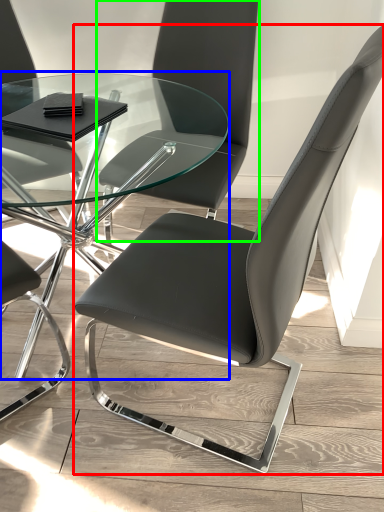
Question: Estimate the real-world distances between objects in this image. Which object is farther from chair (highlighted by a red box), table (highlighted by a blue box) or chair (highlighted by a green box)?

Choices:
 (A) table
 (B) chair

Answer: (A)